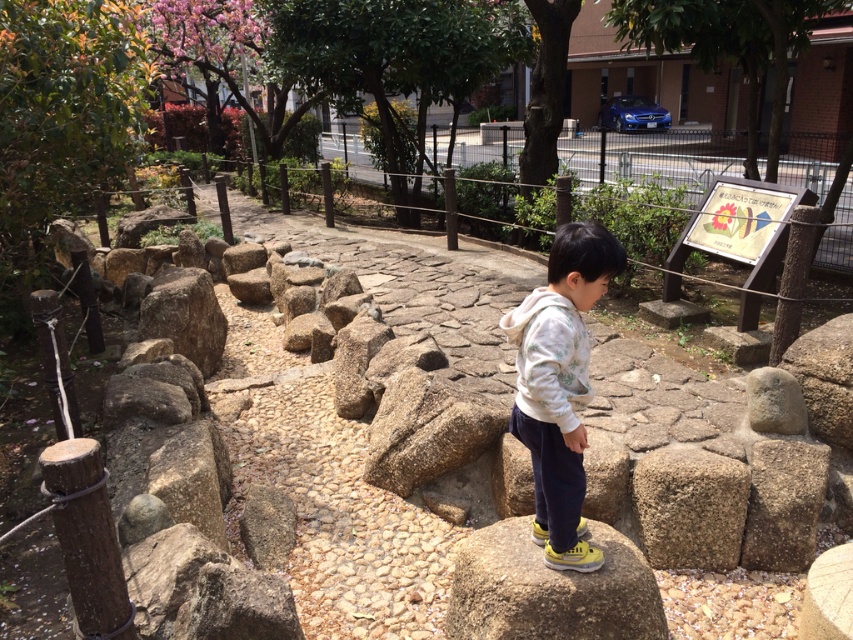
Question: Is smooth gray rock at center bigger than rough stone boulder at center-left?

Choices:
 (A) yes
 (B) no

Answer: (B)

Question: Which object appears closest to the camera in this image?

Choices:
 (A) smooth gray rock at center
 (B) rough stone boulder at center-left
 (C) white fleece jacket at center

Answer: (C)

Question: Which point is farther from the camera taking this photo?

Choices:
 (A) (572, 522)
 (B) (412, 397)

Answer: (B)

Question: Is rough stone boulder at center thinner than rough stone boulder at center-left?

Choices:
 (A) no
 (B) yes

Answer: (A)

Question: Among these objects, which one is nearest to the camera?

Choices:
 (A) smooth gray rock at center
 (B) rough stone boulder at center

Answer: (A)

Question: Can you confirm if white fleece jacket at center is positioned to the left of brown rough stone at center?

Choices:
 (A) yes
 (B) no

Answer: (A)